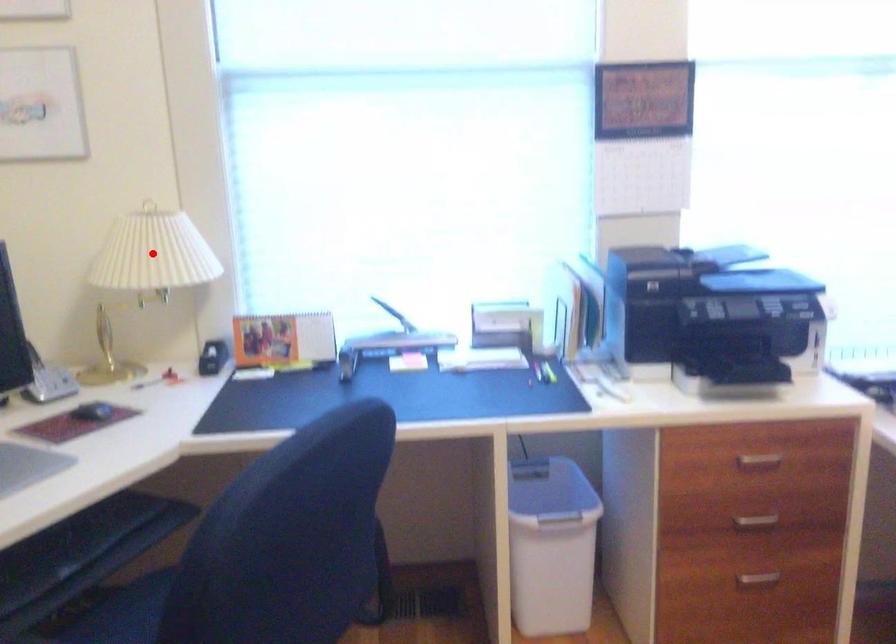
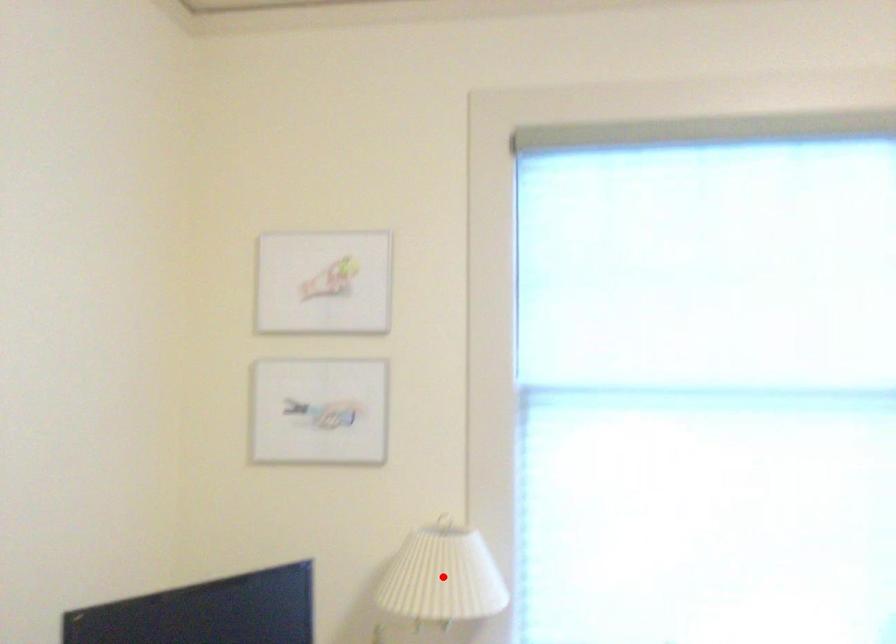
In the scene shown: I am providing you with two images of the same scene from different viewpoints. A red point is marked on the first image and another point is marked on the second image. Are the points marked in image1 and image2 representing the same 3D position?

Yes